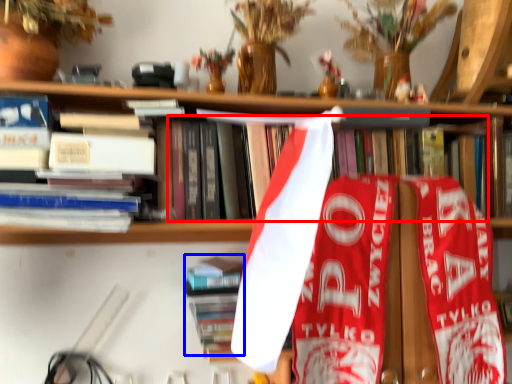
Question: Among these objects, which one is farthest to the camera, book (highlighted by a red box) or book (highlighted by a blue box)?

Choices:
 (A) book
 (B) book

Answer: (B)